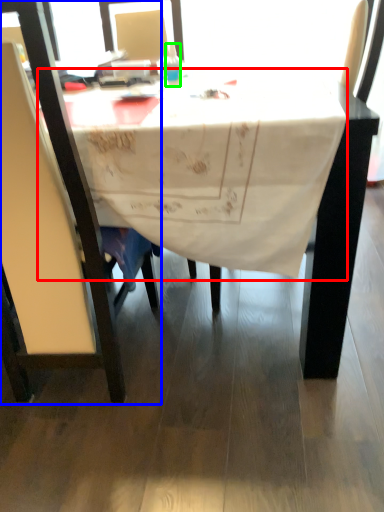
Question: Considering the real-world distances, which object is farthest from tablecloth (highlighted by a red box)? chair (highlighted by a blue box) or bottle (highlighted by a green box)?

Choices:
 (A) chair
 (B) bottle

Answer: (B)